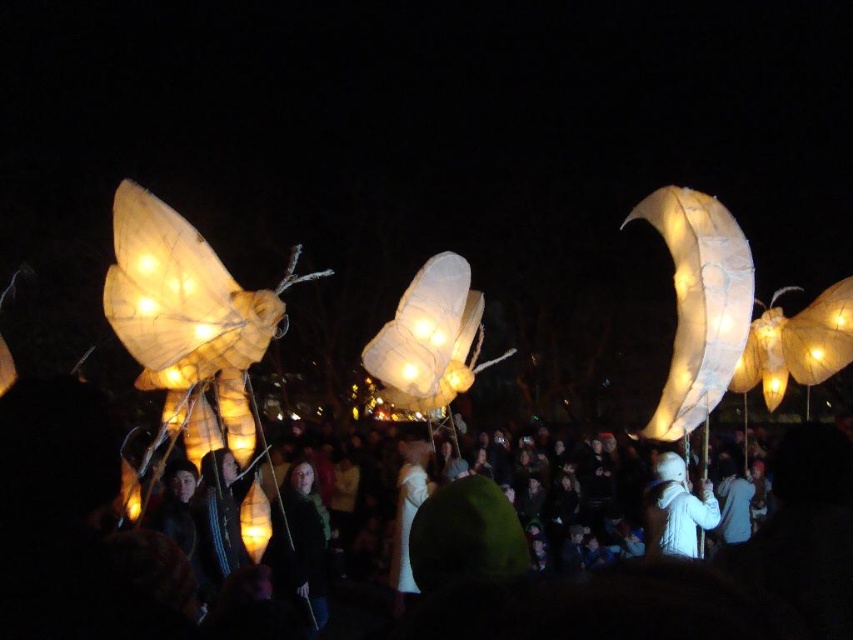
Can you confirm if illuminated paper lantern at center is positioned to the right of white matte coat at center?

In fact, illuminated paper lantern at center is to the left of white matte coat at center.

Between illuminated paper lantern at center and white matte coat at center, which one is positioned lower?

Positioned lower is white matte coat at center.

Image resolution: width=853 pixels, height=640 pixels. What do you see at coordinates (428, 339) in the screenshot?
I see `illuminated paper lantern at center` at bounding box center [428, 339].

You are a GUI agent. You are given a task and a screenshot of the screen. Output one action in this format:
    pyautogui.click(x=<x>, y=<y>)
    Task: Click on the illuminated paper lantern at center
    The width and height of the screenshot is (853, 640).
    Given the screenshot: What is the action you would take?
    pyautogui.click(x=428, y=339)

Based on the photo, who is higher up, illuminated paper crescent moon at right or illuminated paper lantern at center?

illuminated paper crescent moon at right

This screenshot has width=853, height=640. Describe the element at coordinates (699, 304) in the screenshot. I see `illuminated paper crescent moon at right` at that location.

Where is `illuminated paper crescent moon at right`? illuminated paper crescent moon at right is located at coordinates (699, 304).

Does white paper lanterns at center have a lesser height compared to white matte coat at center?

Incorrect, white paper lanterns at center's height does not fall short of white matte coat at center's.

Is point (103, 580) farther from viewer compared to point (660, 477)?

No, it is in front of (660, 477).

Locate an element on the screen. white paper lanterns at center is located at coordinates (666, 593).